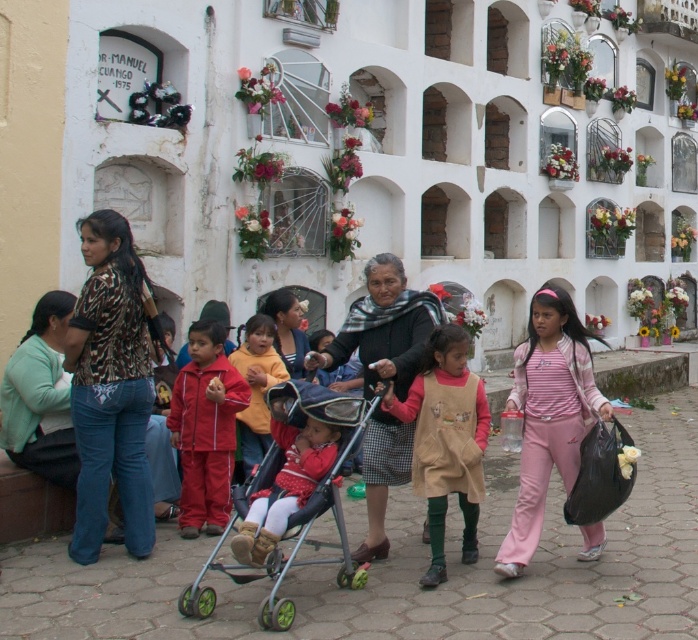
The image size is (698, 640). What do you see at coordinates (445, 440) in the screenshot? I see `beige corduroy dress at center` at bounding box center [445, 440].

Is beige corduroy dress at center above green rubber baby carriage at center?

Correct, beige corduroy dress at center is located above green rubber baby carriage at center.

Is point (463, 468) positioned before point (309, 408)?

No, it is behind (309, 408).

Image resolution: width=698 pixels, height=640 pixels. Identify the location of beige corduroy dress at center. (445, 440).

Does printed fabric blouse at left appear over red track suit at center?

Yes, printed fabric blouse at left is above red track suit at center.

Which is in front, point (135, 417) or point (178, 413)?

Point (135, 417)

Locate an element on the screen. The image size is (698, 640). printed fabric blouse at left is located at coordinates (110, 388).

Find the location of a particular element. printed fabric blouse at left is located at coordinates (110, 388).

Is point (126, 388) closer to viewer compared to point (422, 291)?

Yes, point (126, 388) is closer to viewer.

Is printed fabric blouse at left bigger than black woolen scarf at center?

No.

Is point (96, 380) farther from viewer compared to point (329, 352)?

No, (96, 380) is in front of (329, 352).

At what (x,y) coordinates should I click in order to perform the action: click on printed fabric blouse at left. Please return your answer as a coordinate pair (x, y). This screenshot has width=698, height=640. Looking at the image, I should click on (110, 388).